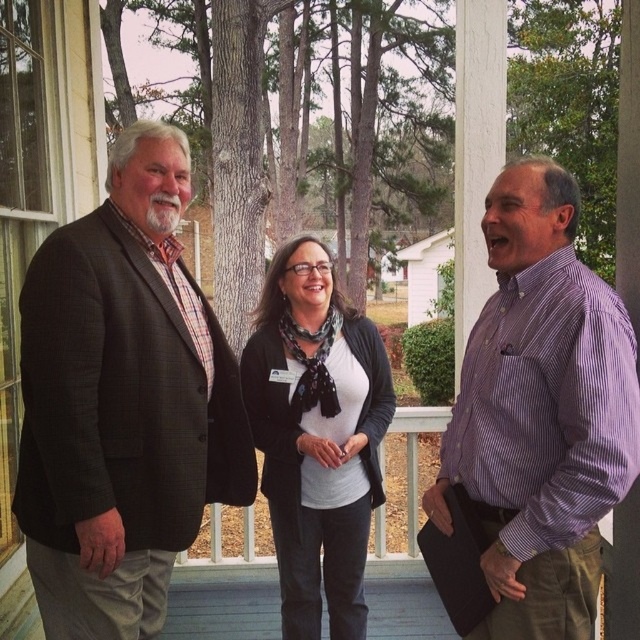
In the scene shown: You are a photographer trying to focus on the purple striped shirt at center. There is a point marked at coordinates (x=541, y=412). Is this point located on the purple striped shirt at center?

Yes, the point marked at coordinates (x=541, y=412) is located on the purple striped shirt at center according to the description.